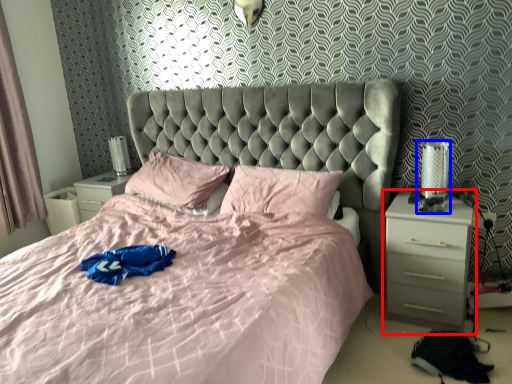
Question: Among these objects, which one is farthest to the camera, nightstand (highlighted by a red box) or table lamp (highlighted by a blue box)?

Choices:
 (A) nightstand
 (B) table lamp

Answer: (B)